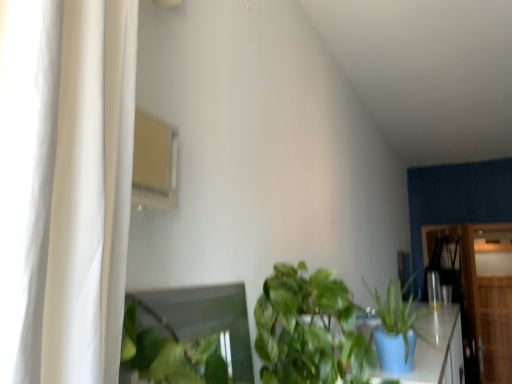
Question: Should I look upward or downward to see green leafy plant at center, marked as the first houseplant in a left-to-right arrangement?

Choices:
 (A) up
 (B) down

Answer: (B)

Question: Can you confirm if wooden dresser at right, placed as the second dresser when sorted from front to back, is wider than green leafy plant at center, placed as the second houseplant when sorted from right to left?

Choices:
 (A) yes
 (B) no

Answer: (B)

Question: Is wooden dresser at right, marked as the first dresser in a back-to-front arrangement, thinner than green leafy plant at center, placed as the second houseplant when sorted from right to left?

Choices:
 (A) no
 (B) yes

Answer: (B)

Question: From a real-world perspective, is wooden dresser at right, placed as the second dresser when sorted from front to back, located higher than green leafy plant at center, placed as the second houseplant when sorted from right to left?

Choices:
 (A) no
 (B) yes

Answer: (A)

Question: Is green leafy plant at center, placed as the second houseplant when sorted from right to left, a part of wooden dresser at right, positioned as the 2th dresser in left-to-right order?

Choices:
 (A) no
 (B) yes

Answer: (A)

Question: Does wooden dresser at right, which is the first dresser from right to left, have a greater height compared to green leafy plant at center, marked as the first houseplant in a left-to-right arrangement?

Choices:
 (A) yes
 (B) no

Answer: (A)

Question: Considering the relative positions of wooden dresser at right, positioned as the 2th dresser in left-to-right order, and green leafy plant at center, placed as the second houseplant when sorted from right to left, in the image provided, is wooden dresser at right, positioned as the 2th dresser in left-to-right order, to the right of green leafy plant at center, placed as the second houseplant when sorted from right to left, from the viewer's perspective?

Choices:
 (A) yes
 (B) no

Answer: (A)

Question: Does wooden dresser at right, which is counted as the 1th dresser, starting from the left, have a larger size compared to matte blue pot at lower right, the 1th houseplant from the right?

Choices:
 (A) yes
 (B) no

Answer: (A)

Question: Can you confirm if wooden dresser at right, the 1th dresser from the front, is positioned to the right of matte blue pot at lower right, the second houseplant when ordered from left to right?

Choices:
 (A) no
 (B) yes

Answer: (B)

Question: Is wooden dresser at right, which ranks as the second dresser in right-to-left order, with matte blue pot at lower right, the 1th houseplant from the right?

Choices:
 (A) no
 (B) yes

Answer: (A)

Question: Is wooden dresser at right, which ranks as the second dresser in right-to-left order, in front of matte blue pot at lower right, the second houseplant when ordered from left to right?

Choices:
 (A) no
 (B) yes

Answer: (A)

Question: Considering the relative sizes of wooden dresser at right, the second dresser from the back, and matte blue pot at lower right, the 1th houseplant from the right, in the image provided, is wooden dresser at right, the second dresser from the back, wider than matte blue pot at lower right, the 1th houseplant from the right,?

Choices:
 (A) yes
 (B) no

Answer: (A)

Question: Considering the relative sizes of wooden dresser at right, the second dresser from the back, and matte blue pot at lower right, the second houseplant when ordered from left to right, in the image provided, is wooden dresser at right, the second dresser from the back, shorter than matte blue pot at lower right, the second houseplant when ordered from left to right,?

Choices:
 (A) yes
 (B) no

Answer: (B)

Question: Does wooden dresser at right, which is the first dresser from right to left, have a smaller size compared to wooden dresser at right, which is counted as the 1th dresser, starting from the left?

Choices:
 (A) yes
 (B) no

Answer: (A)